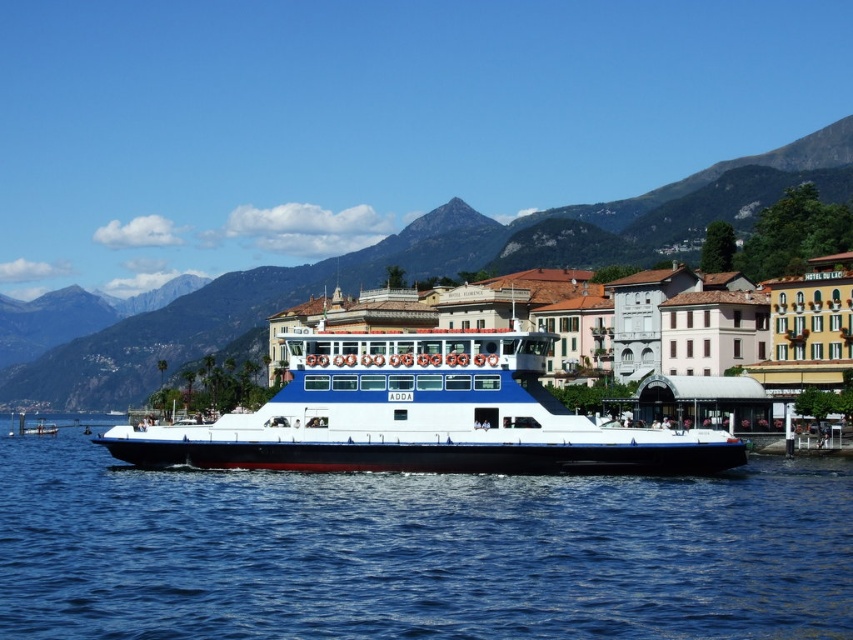
You are a tourist on the lakeside and want to take a photo of the white matte cruise ship at center and the rugged stone mountain at center. From your current position, which object is closer to you?

The white matte cruise ship at center is positioned under rugged stone mountain at center, so the cruise ship is closer to you than the mountain.